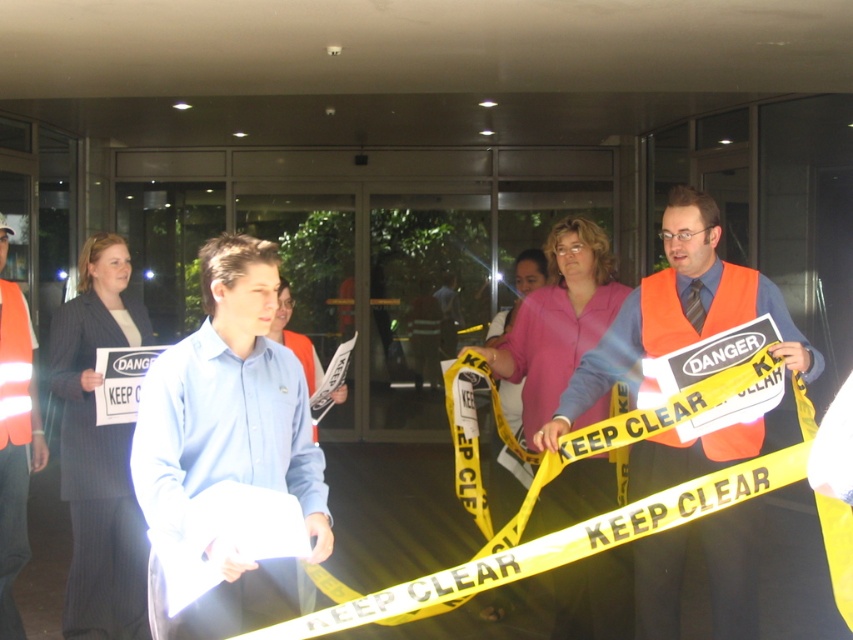
You are a drone operator trying to capture a photo of the two points mentioned. The camera has a focal length of 50mm. If point A is at coordinates point (241, 321) and point B is at point (16, 460), which point will appear larger in the photo?

Point A at coordinates point (241, 321) will appear larger in the photo because it is closer to the camera than point B at point (16, 460).

Consider the image. You are a delivery person standing 6 feet away from the blue shirt at center. Can you safely approach within 6 feet to deliver a package without violating social distancing guidelines?

The blue shirt at center is 6.96 feet from the camera. Since you are standing 6 feet away, approaching within 6 feet would mean getting closer than the current distance, which may violate social distancing guidelines depending on local requirements. However, the exact guideline adherence depends on the specific rules in place.